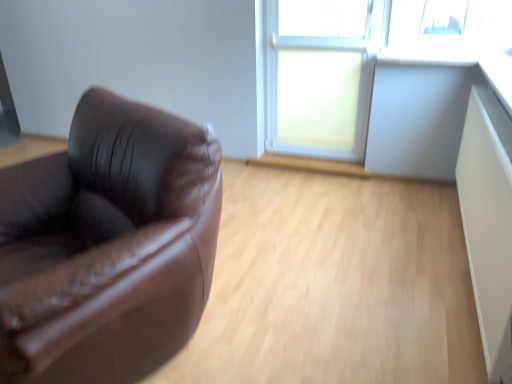
Question: From the image's perspective, is matte glass window at center below white plastic window frame at upper right?

Choices:
 (A) yes
 (B) no

Answer: (A)

Question: Considering the relative sizes of matte glass window at center and white plastic window frame at upper right in the image provided, is matte glass window at center shorter than white plastic window frame at upper right?

Choices:
 (A) yes
 (B) no

Answer: (A)

Question: Is matte glass window at center not close to white plastic window frame at upper right?

Choices:
 (A) yes
 (B) no

Answer: (B)

Question: Considering the relative sizes of matte glass window at center and white plastic window frame at upper right in the image provided, is matte glass window at center smaller than white plastic window frame at upper right?

Choices:
 (A) yes
 (B) no

Answer: (A)

Question: From a real-world perspective, is matte glass window at center below white plastic window frame at upper right?

Choices:
 (A) no
 (B) yes

Answer: (B)

Question: Can you confirm if matte glass window at center is positioned to the left of white plastic window frame at upper right?

Choices:
 (A) no
 (B) yes

Answer: (B)

Question: From a real-world perspective, is white plastic window frame at upper right located beneath matte glass window at center?

Choices:
 (A) no
 (B) yes

Answer: (A)

Question: Is white plastic window frame at upper right outside of matte glass window at center?

Choices:
 (A) yes
 (B) no

Answer: (B)

Question: Is matte glass window at center a part of white plastic window frame at upper right?

Choices:
 (A) no
 (B) yes

Answer: (B)

Question: Does white plastic window frame at upper right come in front of matte glass window at center?

Choices:
 (A) yes
 (B) no

Answer: (A)

Question: From the image's perspective, is white plastic window frame at upper right located beneath matte glass window at center?

Choices:
 (A) no
 (B) yes

Answer: (A)

Question: Is white plastic window frame at upper right wider than matte glass window at center?

Choices:
 (A) yes
 (B) no

Answer: (A)

Question: Considering the positions of matte glass window at center and white plastic window frame at upper right in the image, is matte glass window at center wider or thinner than white plastic window frame at upper right?

Choices:
 (A) thin
 (B) wide

Answer: (A)